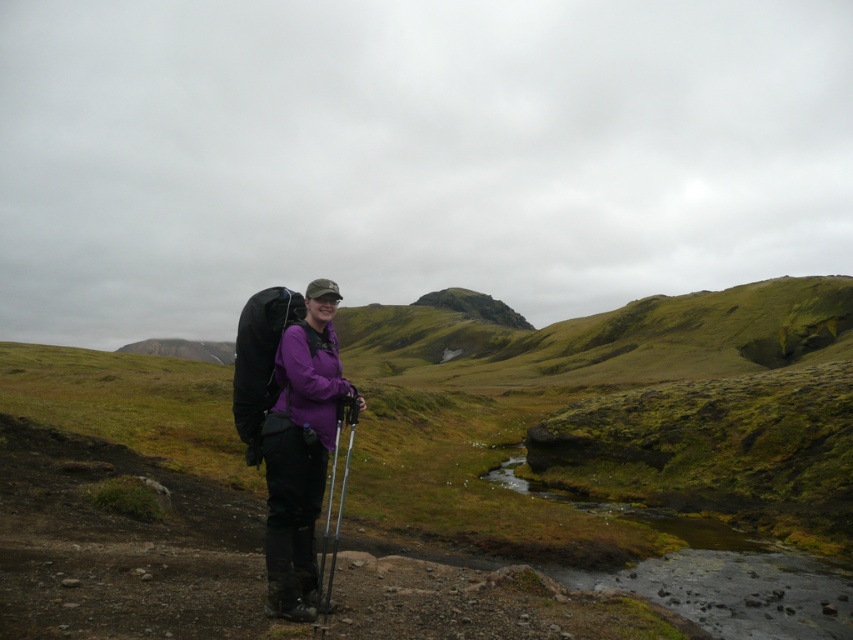
You are a photographer trying to capture the hiker in the center of the image. According to the coordinates provided, where should you focus your camera to ensure the purple matte jacket at center is centered in the photo?

The purple matte jacket at center is located at coordinates point [300,449], so you should focus your camera there to center it in the photo.

You are a photographer planning to take a portrait of the hiker in the scene. You need to ensure that both the purple matte jacket at center and the metallic silver ski pole at center are clearly visible in the frame. Based on their heights, which object might require you to adjust your camera angle to avoid being cut off?

The metallic silver ski pole at center is taller than the purple matte jacket at center, so you might need to adjust your camera angle to ensure the pole isn

You are a photographer trying to capture the hiker in the scene. Since the purple matte jacket at center and the metallic silver ski pole at center are both at the center, which object will appear wider in the photo?

The metallic silver ski pole at center appears wider in the photo because it has a greater width than the purple matte jacket at center.